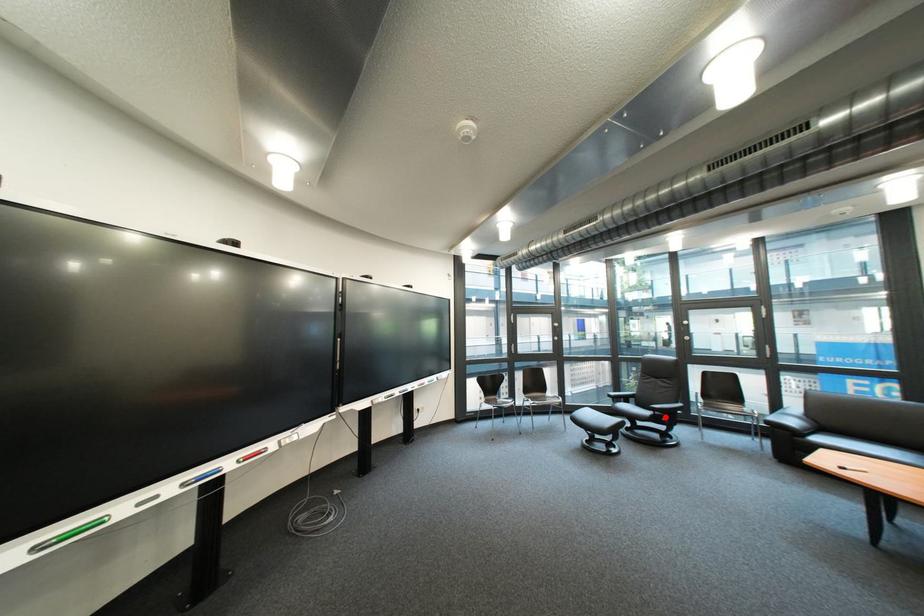
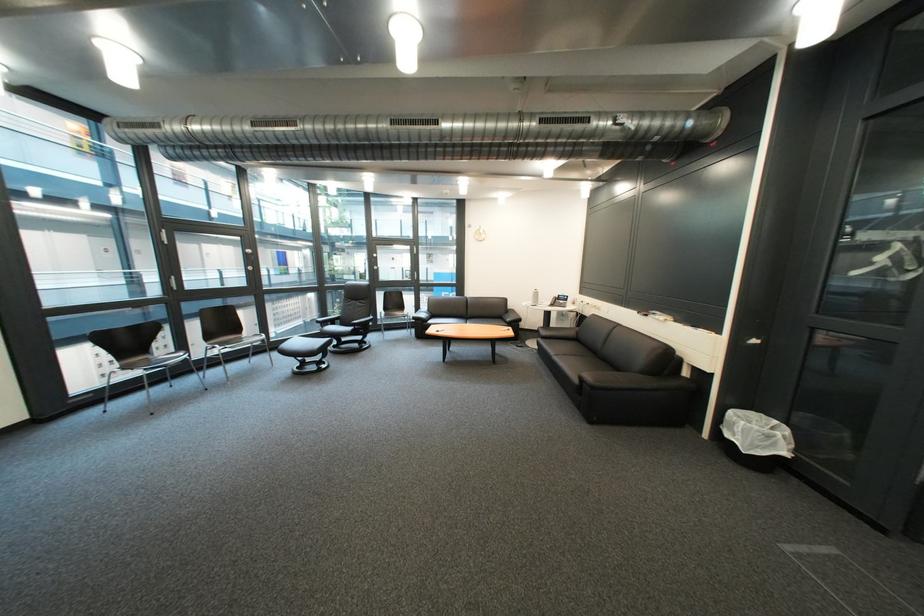
Question: I am providing you with two images of the same scene from different viewpoints. Image1 has a red point marked. In image2, the corresponding 3D location appears at what relative position? Reply with the corresponding letter.

Choices:
 (A) Closer
 (B) Farther

Answer: (A)